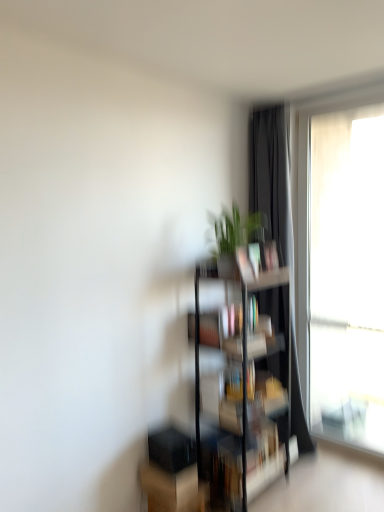
Image resolution: width=384 pixels, height=512 pixels. What are the coordinates of `vacant area that is in front of black matte curtain at right` in the screenshot? It's located at click(x=323, y=494).